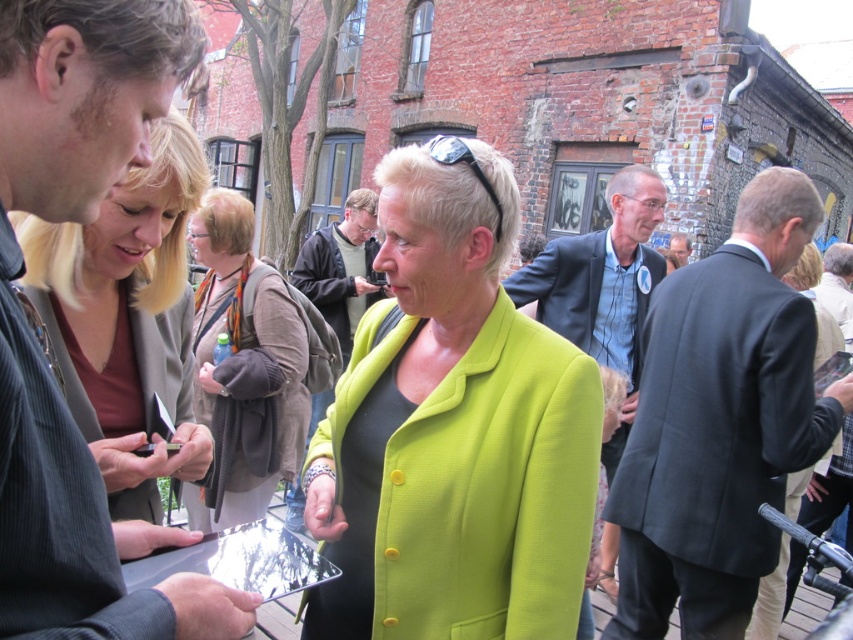
Question: Can you confirm if dark blue suit at right is positioned above green matte jacket at center?

Choices:
 (A) yes
 (B) no

Answer: (A)

Question: Does matte brown leather jacket at upper left have a larger size compared to brown textured scarf at center?

Choices:
 (A) yes
 (B) no

Answer: (A)

Question: Which is farther from the dark blue suit at center?

Choices:
 (A) blue striped shirt at center
 (B) brown textured scarf at center

Answer: (B)

Question: Is lime green fabric jacket at center thinner than brown textured scarf at center?

Choices:
 (A) no
 (B) yes

Answer: (A)

Question: Which of these objects is positioned closest to the dark blue suit at right?

Choices:
 (A) matte brown leather jacket at upper left
 (B) lime green fabric jacket at center
 (C) blue striped shirt at center

Answer: (C)

Question: Among these points, which one is farthest from the camera?

Choices:
 (A) (628, 340)
 (B) (465, 225)

Answer: (A)